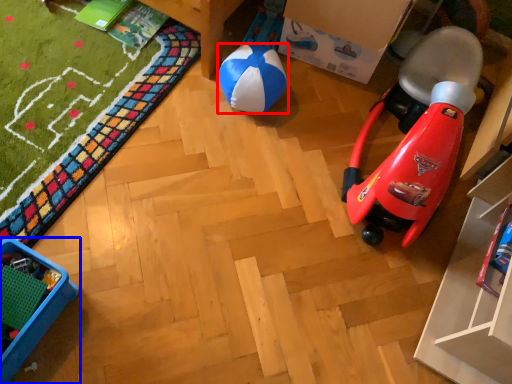
Question: Among these objects, which one is farthest to the camera, ball (highlighted by a red box) or furniture (highlighted by a blue box)?

Choices:
 (A) ball
 (B) furniture

Answer: (A)